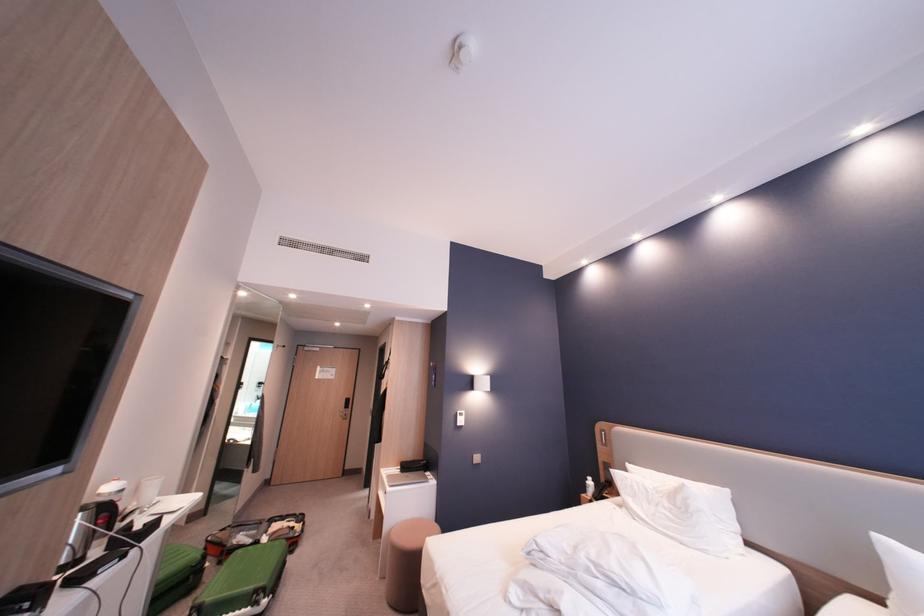
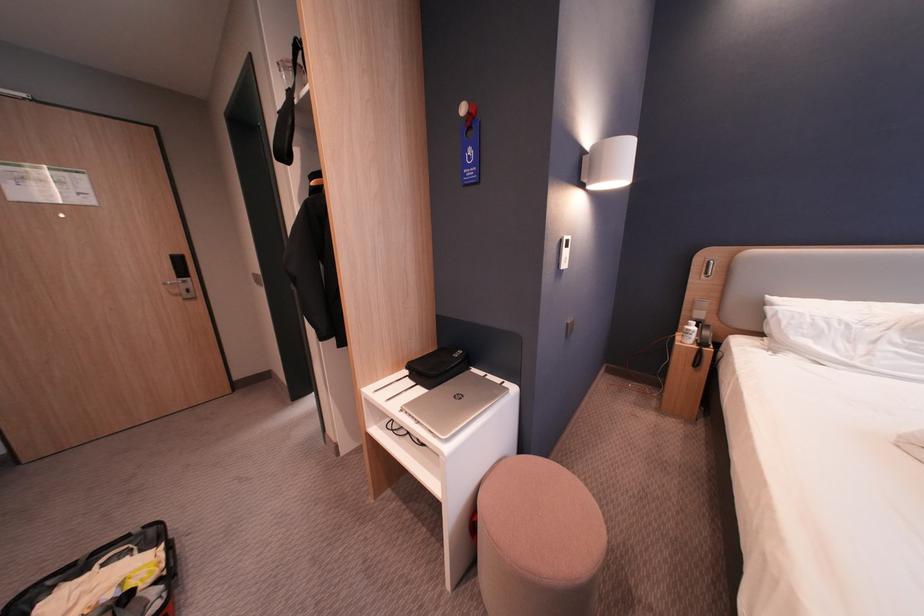
Locate, in the second image, the point that corresponds to (599,483) in the first image.

(698, 328)